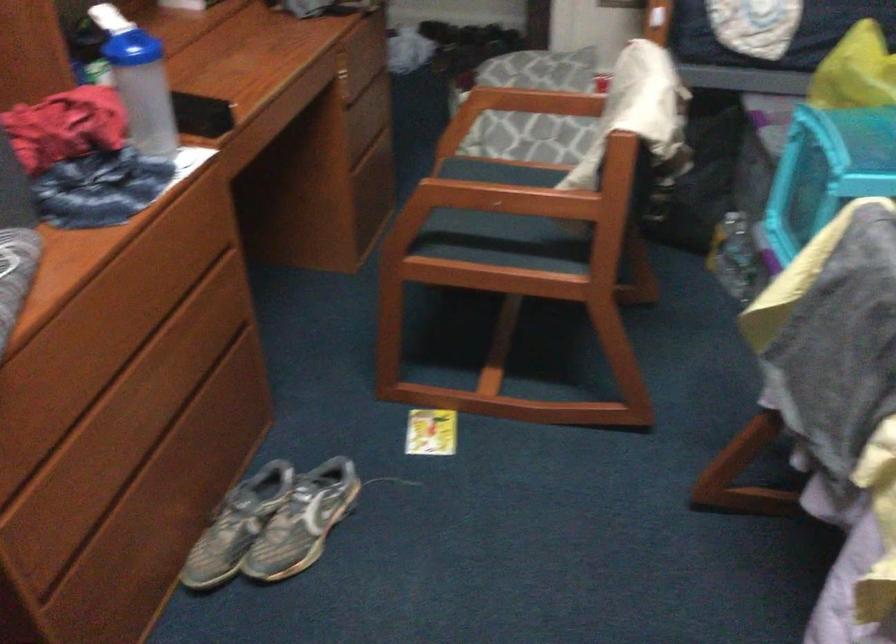
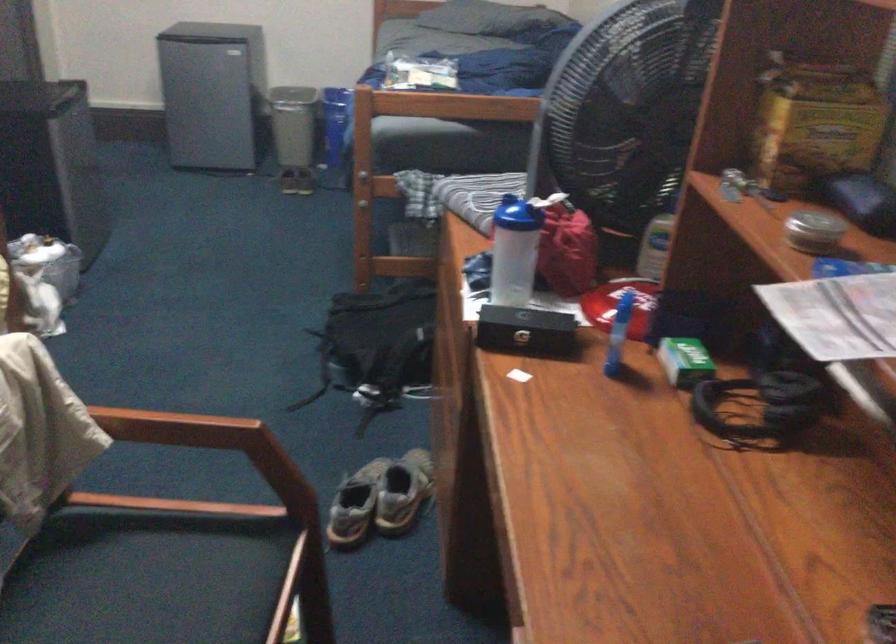
In the second image, find the point that corresponds to (188,102) in the first image.

(526, 330)